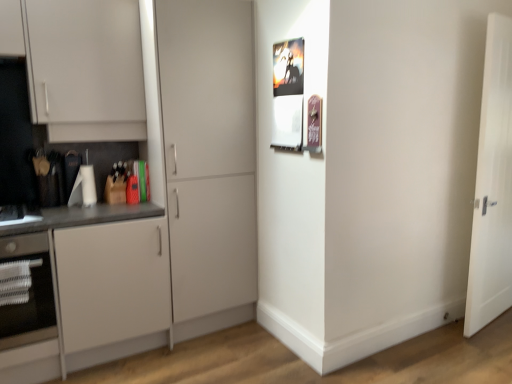
Question: From a real-world perspective, does matte white cabinet at center, which ranks as the first door in left-to-right order, stand above white glossy oven at lower left?

Choices:
 (A) no
 (B) yes

Answer: (B)

Question: Does matte white cabinet at center, arranged as the 2th door when viewed from the right, have a smaller size compared to white glossy oven at lower left?

Choices:
 (A) no
 (B) yes

Answer: (A)

Question: Is matte white cabinet at center, which ranks as the first door in left-to-right order, facing away from white glossy oven at lower left?

Choices:
 (A) no
 (B) yes

Answer: (A)

Question: Is matte white cabinet at center, which ranks as the first door in left-to-right order, at the right side of white glossy oven at lower left?

Choices:
 (A) no
 (B) yes

Answer: (B)

Question: From the image's perspective, does matte white cabinet at center, which ranks as the first door in left-to-right order, appear lower than white glossy oven at lower left?

Choices:
 (A) no
 (B) yes

Answer: (A)

Question: Is matte white cabinet at center, arranged as the 2th door when viewed from the right, bigger or smaller than white wooden door at right, which is the first door from right to left?

Choices:
 (A) small
 (B) big

Answer: (B)

Question: From the image's perspective, is matte white cabinet at center, which ranks as the first door in left-to-right order, above or below white wooden door at right, which is the first door from right to left?

Choices:
 (A) below
 (B) above

Answer: (B)

Question: In the image, is matte white cabinet at center, which ranks as the first door in left-to-right order, positioned in front of or behind white wooden door at right, marked as the 2th door in a left-to-right arrangement?

Choices:
 (A) behind
 (B) front

Answer: (B)

Question: From a real-world perspective, is matte white cabinet at center, which ranks as the first door in left-to-right order, physically located above or below white wooden door at right, which is the first door from right to left?

Choices:
 (A) above
 (B) below

Answer: (A)

Question: Is point (485, 241) closer or farther from the camera than point (231, 190)?

Choices:
 (A) closer
 (B) farther

Answer: (A)

Question: From the image's perspective, is white wooden door at right, which is the first door from right to left, located above or below matte white cabinet at center, which ranks as the first door in left-to-right order?

Choices:
 (A) below
 (B) above

Answer: (A)

Question: Based on their sizes in the image, would you say white wooden door at right, which is the first door from right to left, is bigger or smaller than matte white cabinet at center, arranged as the 2th door when viewed from the right?

Choices:
 (A) big
 (B) small

Answer: (B)

Question: Visually, is white wooden door at right, marked as the 2th door in a left-to-right arrangement, positioned to the left or to the right of matte white cabinet at center, which ranks as the first door in left-to-right order?

Choices:
 (A) right
 (B) left

Answer: (A)

Question: From a real-world perspective, relative to matte white cabinet at center, which ranks as the first door in left-to-right order, is white matte cabinet at left vertically above or below?

Choices:
 (A) below
 (B) above

Answer: (A)

Question: Considering the positions of white matte cabinet at left and matte white cabinet at center, arranged as the 2th door when viewed from the right, in the image, is white matte cabinet at left taller or shorter than matte white cabinet at center, arranged as the 2th door when viewed from the right,?

Choices:
 (A) short
 (B) tall

Answer: (A)